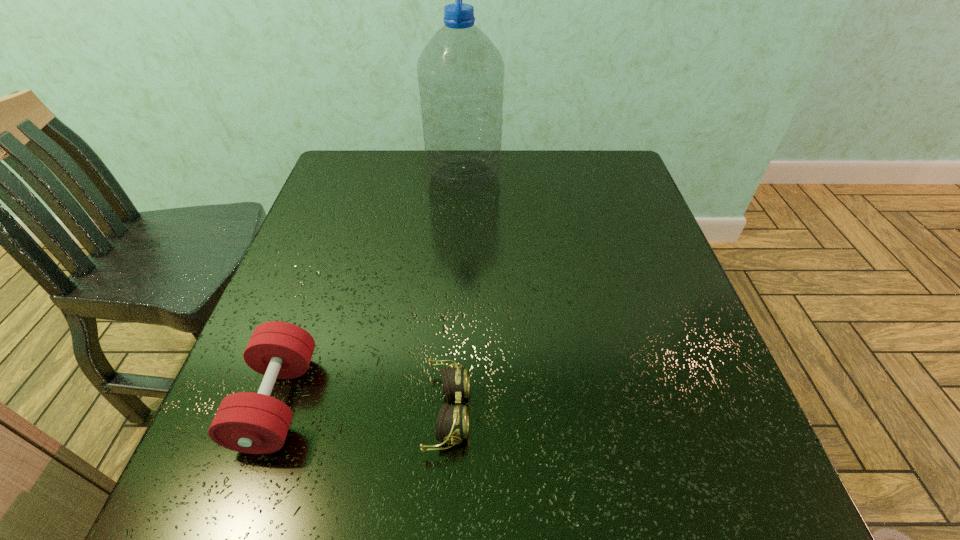
This screenshot has width=960, height=540. What are the coordinates of `the tallest object` in the screenshot? It's located at (460, 72).

At what (x,y) coordinates should I click in order to perform the action: click on water jug. Please return your answer as a coordinate pair (x, y). This screenshot has height=540, width=960. Looking at the image, I should click on (460, 72).

The height and width of the screenshot is (540, 960). I want to click on the second shortest object, so (254, 423).

Locate an element on the screen. dumbbell is located at coordinates (254, 423).

The image size is (960, 540). In order to click on the shortest object in this screenshot , I will do `click(452, 423)`.

In order to click on vacant space located on the right of the farthest object in this screenshot , I will do `click(553, 176)`.

The width and height of the screenshot is (960, 540). Find the location of `vacant space located on the right of the leftmost object`. vacant space located on the right of the leftmost object is located at coordinates (454, 402).

You are a GUI agent. You are given a task and a screenshot of the screen. Output one action in this format:
    pyautogui.click(x=<x>, y=<y>)
    Task: Click on the free space located 0.380m through the lenses of the shortest object
    
    Given the screenshot: What is the action you would take?
    pyautogui.click(x=694, y=411)

Identify the location of object present at the far edge. The image size is (960, 540). (460, 72).

Find the location of a particular element. object positioned at the left edge is located at coordinates (254, 423).